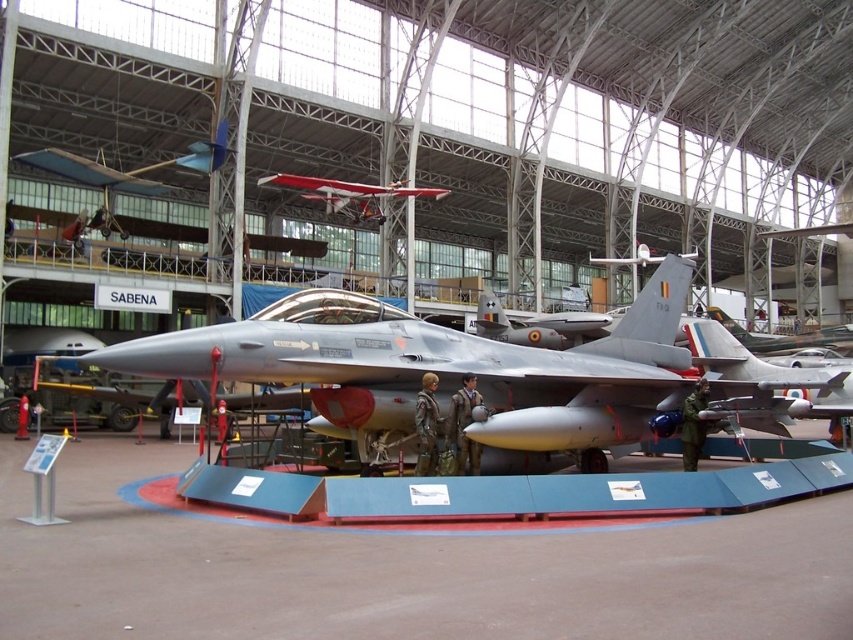
Between silver metallic fighter jet at center and red matte biplane at upper center, which one has less height?

Standing shorter between the two is silver metallic fighter jet at center.

In the scene shown: Who is more distant from viewer, (651,380) or (433,198)?

Point (433,198)

Identify the location of silver metallic fighter jet at center. (444, 369).

This screenshot has width=853, height=640. Identify the location of silver metallic fighter jet at center. (444, 369).